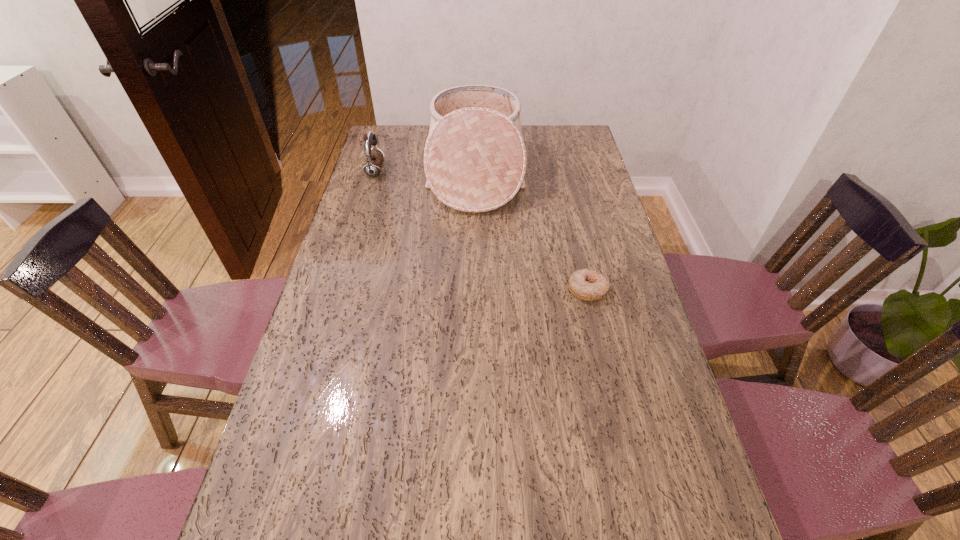
The height and width of the screenshot is (540, 960). What are the coordinates of `object at the left edge` in the screenshot? It's located at (374, 158).

Locate an element on the screen. Image resolution: width=960 pixels, height=540 pixels. object present at the right edge is located at coordinates (586, 284).

In the image, there is a desktop. At what (x,y) coordinates should I click in order to perform the action: click on free space at the left edge. Please return your answer as a coordinate pair (x, y). Image resolution: width=960 pixels, height=540 pixels. Looking at the image, I should click on (357, 215).

This screenshot has height=540, width=960. I want to click on vacant space at the right edge of the desktop, so click(611, 301).

This screenshot has width=960, height=540. In the image, there is a desktop. What are the coordinates of `blank space at the far left corner` in the screenshot? It's located at (415, 129).

This screenshot has height=540, width=960. I want to click on vacant space at the far right corner of the desktop, so click(x=567, y=140).

The height and width of the screenshot is (540, 960). I want to click on free point between the leftmost object and the doughnut, so click(481, 230).

Locate which object ranks second in proximity to the leftmost object. Please provide its 2D coordinates. Your answer should be formatted as a tuple, i.e. [(x, y)], where the tuple contains the x and y coordinates of a point satisfying the conditions above.

[(586, 284)]

Locate which object ranks second in proximity to the earphone. Please provide its 2D coordinates. Your answer should be formatted as a tuple, i.e. [(x, y)], where the tuple contains the x and y coordinates of a point satisfying the conditions above.

[(586, 284)]

Where is `blank area in the image that satisfies the following two spatial constraints: 1. on the ear pads of the second shortest object; 2. on the back side of the shortest object`? The width and height of the screenshot is (960, 540). blank area in the image that satisfies the following two spatial constraints: 1. on the ear pads of the second shortest object; 2. on the back side of the shortest object is located at coordinates (340, 289).